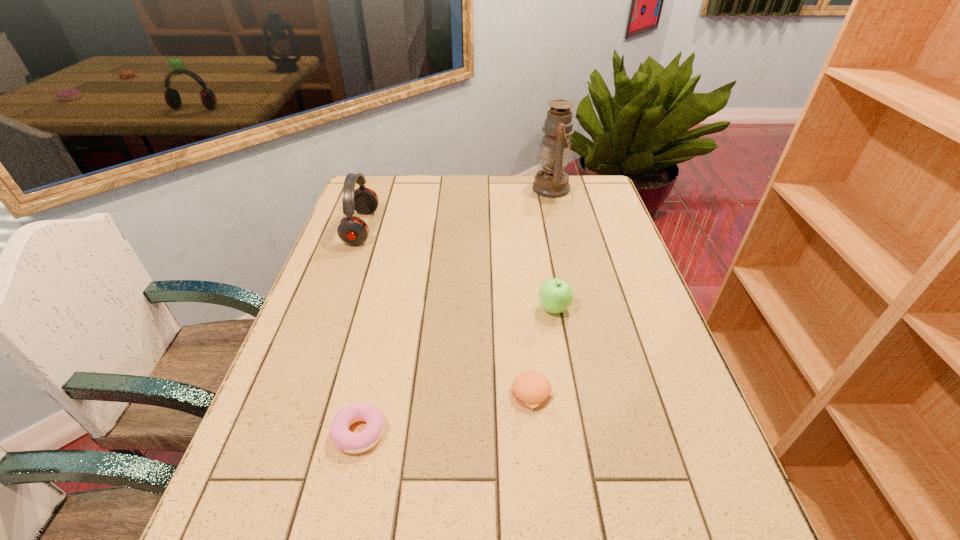
What are the coordinates of `unoccupied area between the pastry and the fourth shortest object` in the screenshot? It's located at (361, 330).

You are a GUI agent. You are given a task and a screenshot of the screen. Output one action in this format:
    pyautogui.click(x=<x>, y=<y>)
    Task: Click on the free space between the farthest object and the second tallest object
    The width and height of the screenshot is (960, 540).
    Given the screenshot: What is the action you would take?
    pyautogui.click(x=458, y=208)

Find the location of a particular element. free space between the pastry and the fourth nearest object is located at coordinates (361, 330).

Choose which object is the nearest neighbor to the pastry. Please provide its 2D coordinates. Your answer should be formatted as a tuple, i.e. [(x, y)], where the tuple contains the x and y coordinates of a point satisfying the conditions above.

[(530, 389)]

The image size is (960, 540). What are the coordinates of `object identified as the second closest to the second tallest object` in the screenshot? It's located at (552, 182).

Locate an element on the screen. The image size is (960, 540). vacant point that satisfies the following two spatial constraints: 1. on the ear cups of the pastry; 2. on the left side of the earphone is located at coordinates (290, 433).

You are a GUI agent. You are given a task and a screenshot of the screen. Output one action in this format:
    pyautogui.click(x=<x>, y=<y>)
    Task: Click on the free space that satisfies the following two spatial constraints: 1. on the back side of the pastry; 2. on the left side of the patty
    
    Given the screenshot: What is the action you would take?
    pyautogui.click(x=369, y=393)

Locate an element on the screen. free space that satisfies the following two spatial constraints: 1. on the ear cups of the leftmost object; 2. on the back side of the third tallest object is located at coordinates (333, 308).

What are the coordinates of `vacant space that satisfies the following two spatial constraints: 1. on the ear cups of the earphone; 2. on the left side of the third shortest object` in the screenshot? It's located at point(333,308).

Where is `vacant space that satisfies the following two spatial constraints: 1. on the ear cups of the patty; 2. on the right side of the second farthest object`? vacant space that satisfies the following two spatial constraints: 1. on the ear cups of the patty; 2. on the right side of the second farthest object is located at coordinates (303, 393).